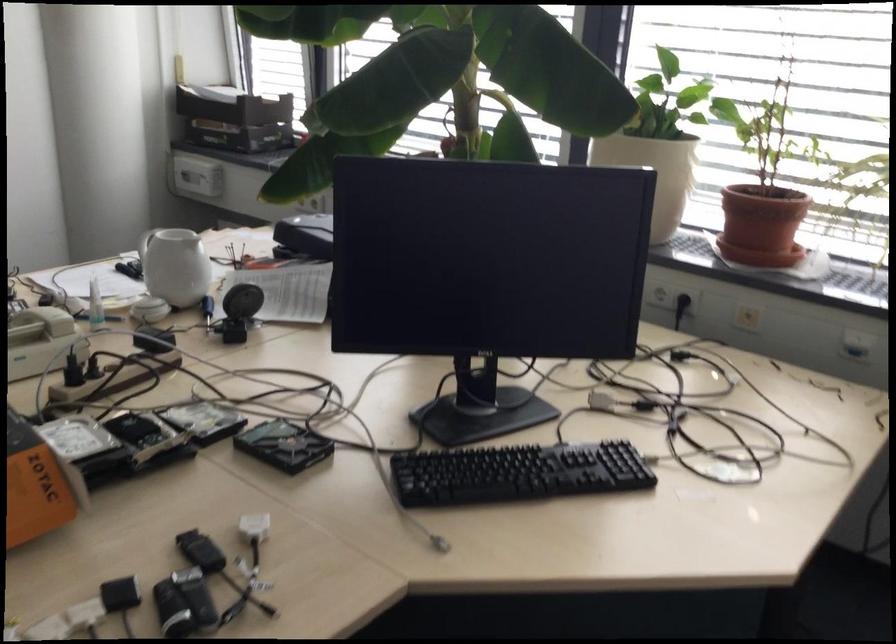
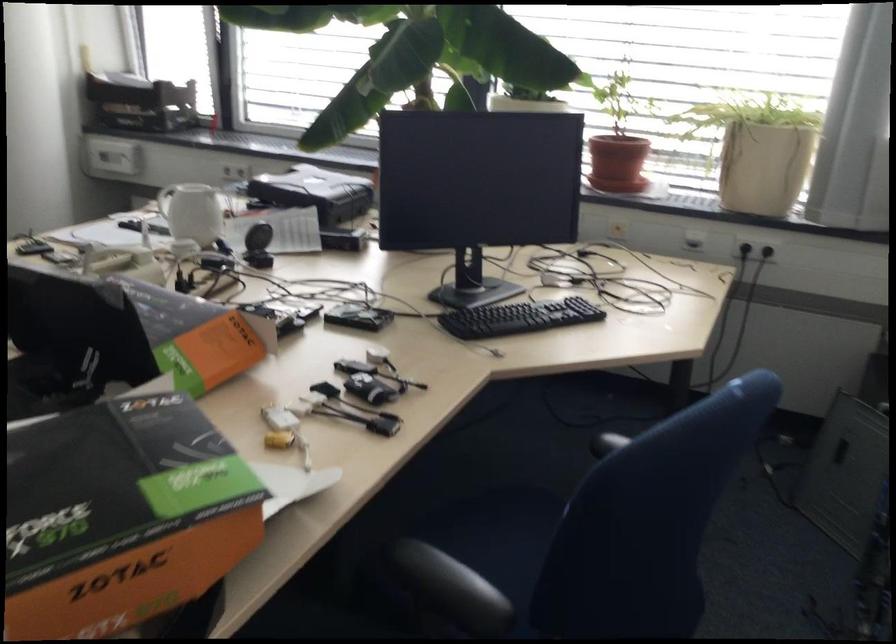
Question: The camera is either moving clockwise (left) or counter-clockwise (right) around the object. The first image is from the beginning of the video and the second image is from the end. Is the camera moving left or right when shooting the video?

Choices:
 (A) Left
 (B) Right

Answer: (A)